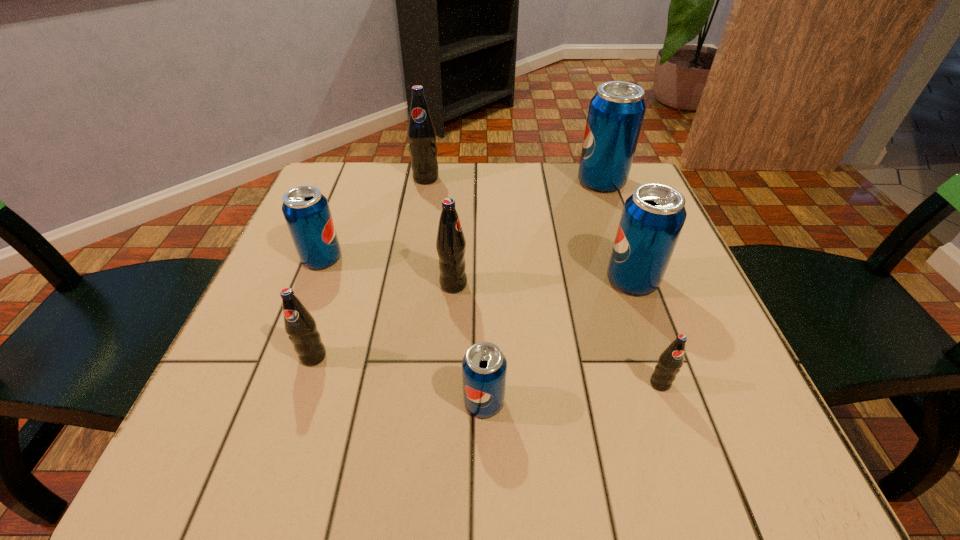
Locate an element on the screen. free location located on the front label of the rightmost black pop is located at coordinates (692, 477).

Identify the location of object that is positioned at the near edge. (484, 367).

The image size is (960, 540). What are the coordinates of `object located at the far right corner` in the screenshot? It's located at (616, 112).

At what (x,y) coordinates should I click in order to perform the action: click on vacant space at the far edge of the desktop. Please return your answer as a coordinate pair (x, y). The height and width of the screenshot is (540, 960). Looking at the image, I should click on (410, 202).

Find the location of `free region at the near edge`. free region at the near edge is located at coordinates (444, 463).

At what (x,y) coordinates should I click in order to perform the action: click on vacant area at the right edge of the desktop. Please return your answer as a coordinate pair (x, y). The height and width of the screenshot is (540, 960). Looking at the image, I should click on (711, 330).

Where is `free space at the far left corner of the desktop`? This screenshot has width=960, height=540. free space at the far left corner of the desktop is located at coordinates (372, 182).

In order to click on vacant space at the near left corner in this screenshot , I will do `click(220, 421)`.

Identify the location of free space at the far right corner of the desktop. The width and height of the screenshot is (960, 540). (642, 173).

In the image, there is a desktop. Identify the location of vacant space at the near right corner. (726, 472).